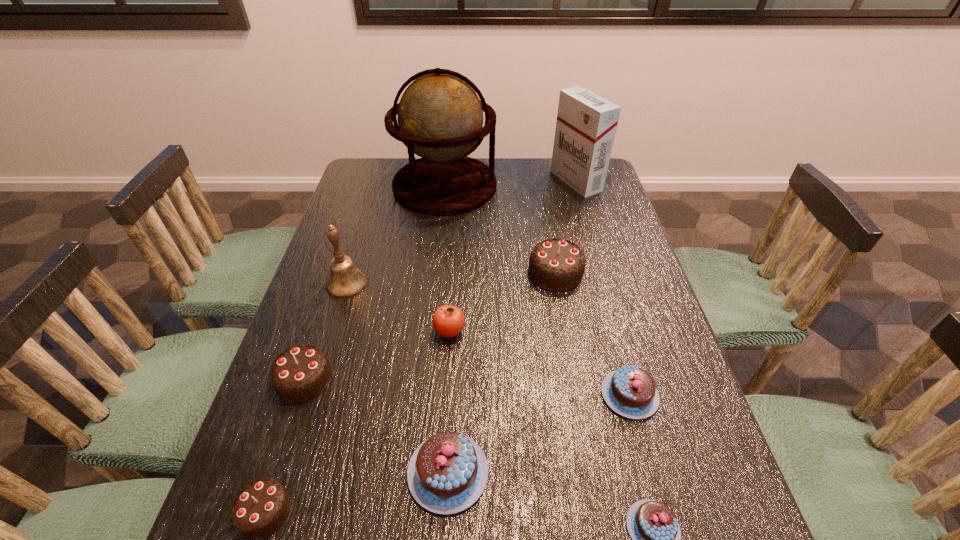
Where is `blank region between the globe and the second biggest pink chocolate cake`? blank region between the globe and the second biggest pink chocolate cake is located at coordinates (538, 290).

Identify the location of unoccupied position between the apple and the biggest pink chocolate cake. The image size is (960, 540). pyautogui.click(x=448, y=402).

The image size is (960, 540). I want to click on vacant space that is in between the cigarette case and the leftmost pink chocolate cake, so click(512, 327).

Choose which object is the seventh nearest neighbor to the second nearest chocolate chocolate cake. Please provide its 2D coordinates. Your answer should be formatted as a tuple, i.e. [(x, y)], where the tuple contains the x and y coordinates of a point satisfying the conditions above.

[(630, 391)]

This screenshot has height=540, width=960. Identify the location of the ninth closest object relative to the smallest pink chocolate cake. (586, 124).

This screenshot has width=960, height=540. What are the coordinates of `chocolate cake that is the closest to the farthest chocolate chocolate cake` in the screenshot? It's located at (630, 391).

Where is `chocolate cake that is the third nearest to the biggest chocolate chocolate cake`? chocolate cake that is the third nearest to the biggest chocolate chocolate cake is located at coordinates 301,372.

Where is `chocolate chocolate cake that is the third closest to the apple`? chocolate chocolate cake that is the third closest to the apple is located at coordinates click(x=260, y=508).

Select which chocolate chocolate cake appears as the closest to the rightmost chocolate chocolate cake. Please provide its 2D coordinates. Your answer should be formatted as a tuple, i.e. [(x, y)], where the tuple contains the x and y coordinates of a point satisfying the conditions above.

[(301, 372)]

Locate an element on the screen. pink chocolate cake that stands as the closest to the shortest chocolate cake is located at coordinates (630, 391).